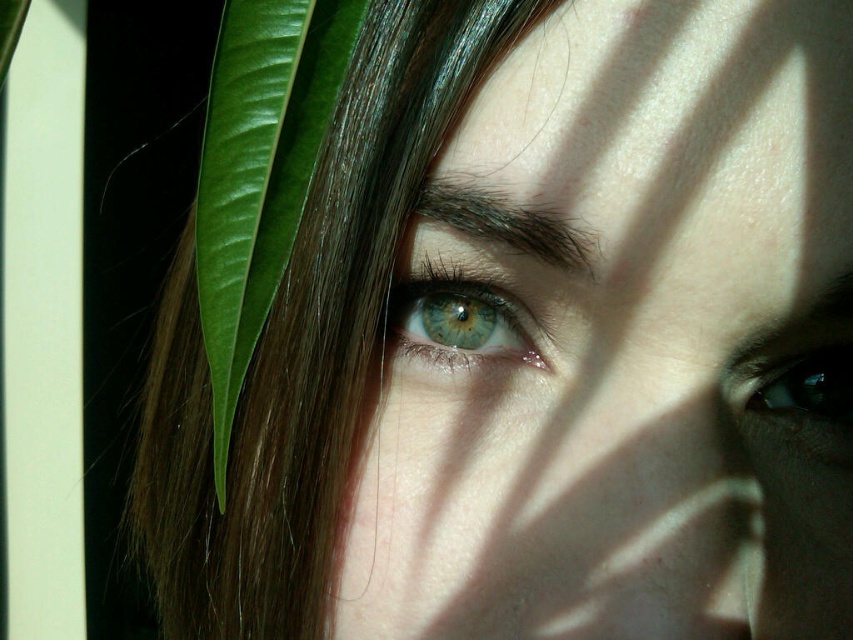
Question: Which object appears farthest from the camera in this image?

Choices:
 (A) green glossy leaf at left
 (B) green matte eye at right

Answer: (B)

Question: Which of the following is the closest to the observer?

Choices:
 (A) (225, 20)
 (B) (804, 400)

Answer: (A)

Question: Is green matte eye at center to the right of green matte eye at right from the viewer's perspective?

Choices:
 (A) no
 (B) yes

Answer: (A)

Question: Can you confirm if green glossy leaf at left is wider than green matte eye at center?

Choices:
 (A) no
 (B) yes

Answer: (B)

Question: Which object is positioned closest to the green glossy leaf at left?

Choices:
 (A) green matte eye at right
 (B) green matte eye at center

Answer: (B)

Question: Does green glossy leaf at left appear over green matte eye at right?

Choices:
 (A) no
 (B) yes

Answer: (B)